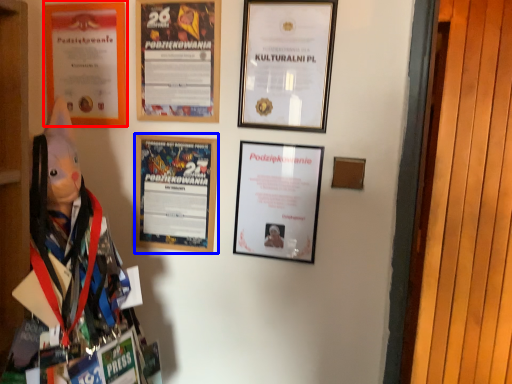
Question: Which object is further to the camera taking this photo, picture frame (highlighted by a red box) or picture frame (highlighted by a blue box)?

Choices:
 (A) picture frame
 (B) picture frame

Answer: (A)